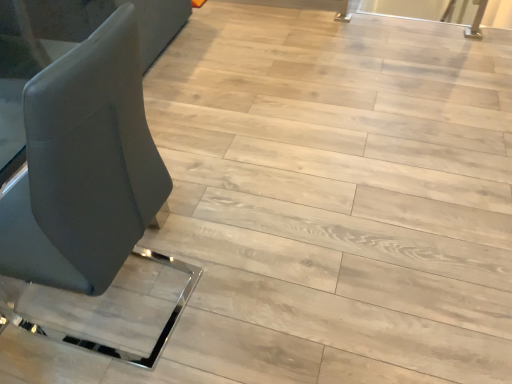
Where is `vacant space underneath matte gray chair at left (from a real-world perspective)`? The image size is (512, 384). vacant space underneath matte gray chair at left (from a real-world perspective) is located at coordinates (141, 300).